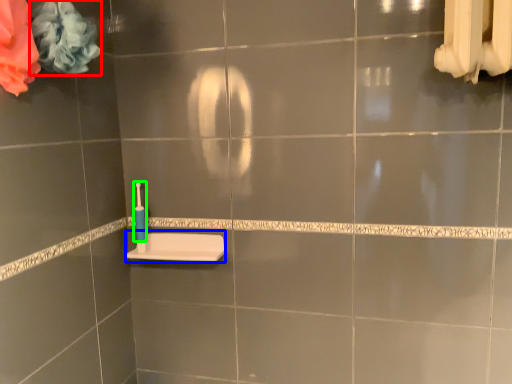
Question: Which object is positioned farthest from flower (highlighted by a red box)? Select from sink (highlighted by a blue box) and toothbrush (highlighted by a green box).

Choices:
 (A) sink
 (B) toothbrush

Answer: (A)